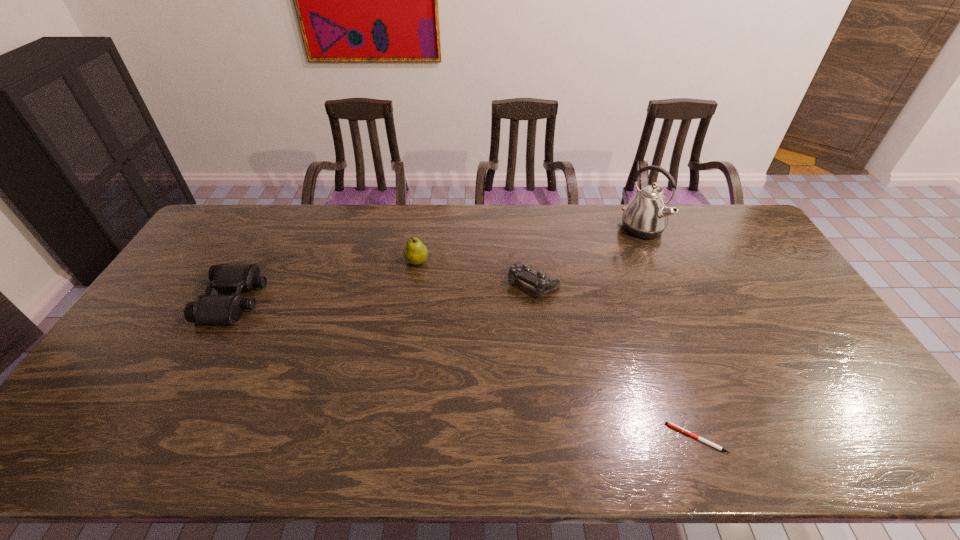
The width and height of the screenshot is (960, 540). What are the coordinates of `the tallest object` in the screenshot? It's located at (646, 216).

The image size is (960, 540). Identify the location of kettle. (646, 216).

Where is `pear`? pear is located at coordinates (415, 252).

You are a GUI agent. You are given a task and a screenshot of the screen. Output one action in this format:
    pyautogui.click(x=<x>, y=<y>)
    Task: Click on the second object from left to right
    
    Given the screenshot: What is the action you would take?
    pyautogui.click(x=415, y=252)

Find the location of `the leftmost object`. the leftmost object is located at coordinates (206, 309).

Where is `the third object from right to left`? The width and height of the screenshot is (960, 540). the third object from right to left is located at coordinates (520, 271).

Where is `the second shortest object`? This screenshot has height=540, width=960. the second shortest object is located at coordinates (520, 271).

What are the coordinates of `the shortest object` in the screenshot? It's located at (670, 424).

Where is `the nearest object`? the nearest object is located at coordinates (670, 424).

Where is `vacant space located on the left of the farthest object`? The height and width of the screenshot is (540, 960). vacant space located on the left of the farthest object is located at coordinates (516, 229).